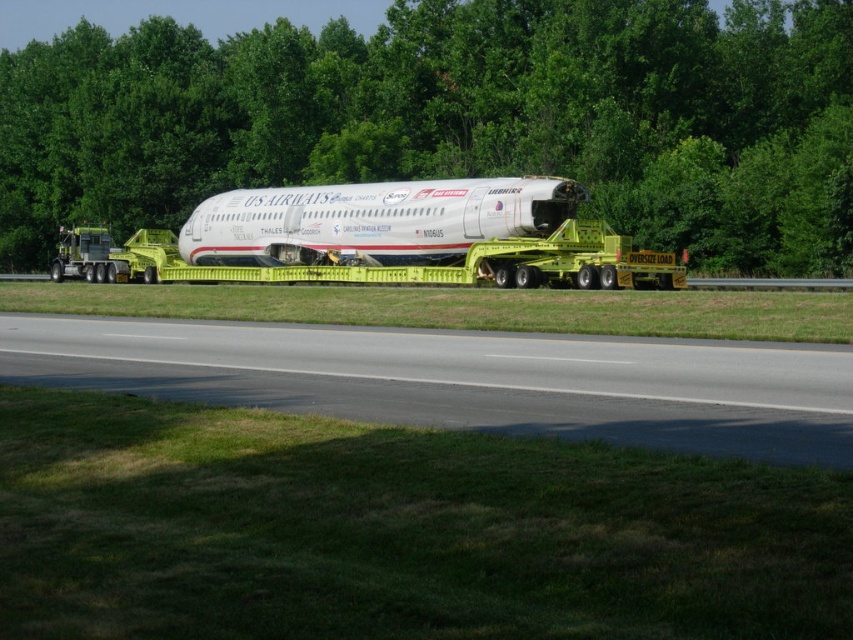
Does green leafy tree at center appear on the right side of white matte airplane at center?

No, green leafy tree at center is not to the right of white matte airplane at center.

Identify the location of green leafy tree at center. Image resolution: width=853 pixels, height=640 pixels. (456, 116).

Find the location of a particular element. Image resolution: width=853 pixels, height=640 pixels. green leafy tree at center is located at coordinates (456, 116).

The width and height of the screenshot is (853, 640). I want to click on green leafy tree at center, so click(x=456, y=116).

Can you confirm if gray asphalt runway at lower center is wider than yellow metallic tow truck at center?

Incorrect, gray asphalt runway at lower center's width does not surpass yellow metallic tow truck at center's.

Consider the image. Which of these two, gray asphalt runway at lower center or yellow metallic tow truck at center, stands shorter?

Standing shorter between the two is gray asphalt runway at lower center.

In order to click on gray asphalt runway at lower center in this screenshot , I will do `click(466, 380)`.

Does point (486, 168) come farther from viewer compared to point (637, 288)?

Yes, it is.

Does green leafy tree at center appear on the right side of yellow metallic tow truck at center?

No, green leafy tree at center is not to the right of yellow metallic tow truck at center.

Is point (746, 189) positioned after point (596, 276)?

Yes.

The image size is (853, 640). What are the coordinates of `green leafy tree at center` in the screenshot? It's located at (456, 116).